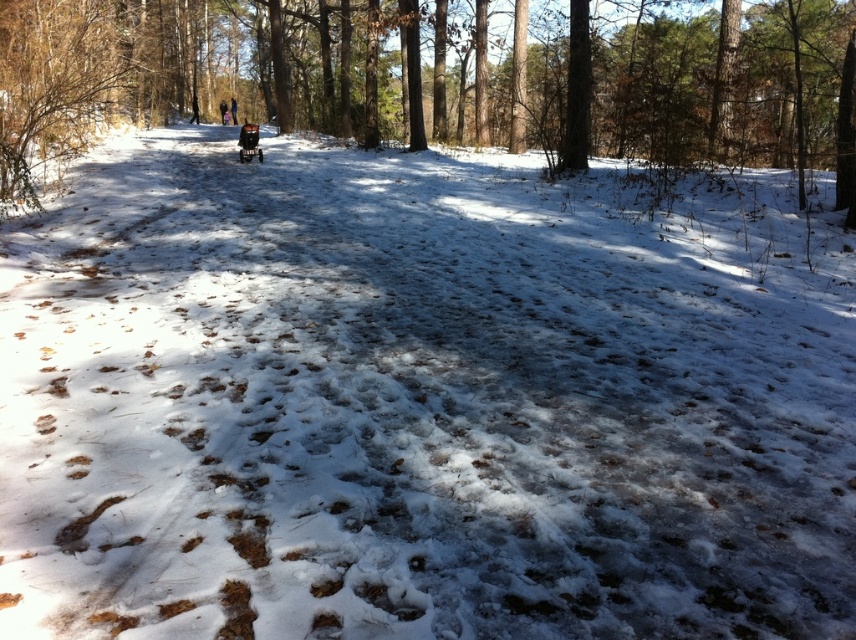
Question: Which of the following is the farthest from the observer?

Choices:
 (A) (236, 109)
 (B) (224, 108)

Answer: (A)

Question: Which point is closer to the camera?

Choices:
 (A) (613, 115)
 (B) (233, 99)
 (C) (221, 112)

Answer: (A)

Question: In this image, where is brown textured tree at center located relative to black fabric stroller at center?

Choices:
 (A) below
 (B) above

Answer: (A)

Question: Does black fabric person at upper center appear over black fabric stroller at center?

Choices:
 (A) no
 (B) yes

Answer: (B)

Question: Does brown textured tree at center have a smaller size compared to black fabric stroller at center?

Choices:
 (A) yes
 (B) no

Answer: (B)

Question: Among these objects, which one is nearest to the camera?

Choices:
 (A) black fabric stroller at center
 (B) brown textured tree at center

Answer: (B)